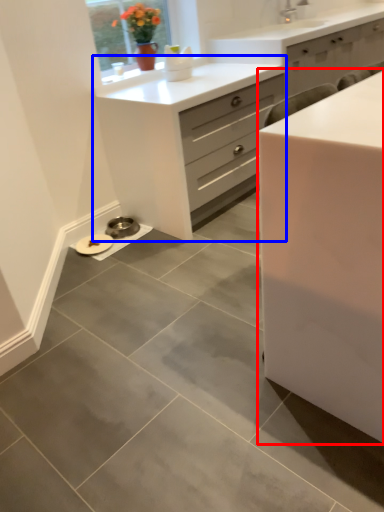
Question: Which object is further to the camera taking this photo, chest of drawers (highlighted by a red box) or chest of drawers (highlighted by a blue box)?

Choices:
 (A) chest of drawers
 (B) chest of drawers

Answer: (B)